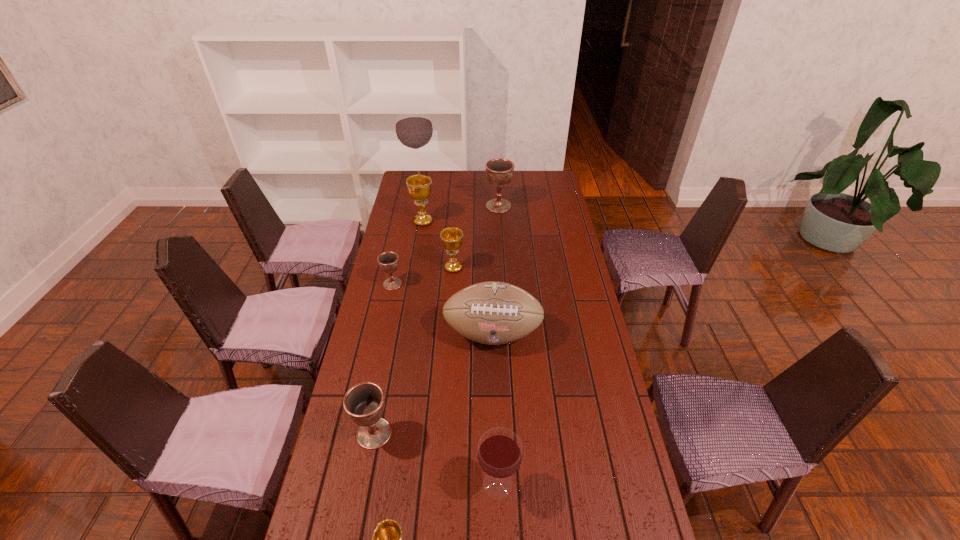
Image resolution: width=960 pixels, height=540 pixels. Identify the location of gold chalice that can be found as the closest to the sixth nearest object. (419, 186).

Find the location of a particular element. the third closest gold chalice to the football (American) is located at coordinates (387, 539).